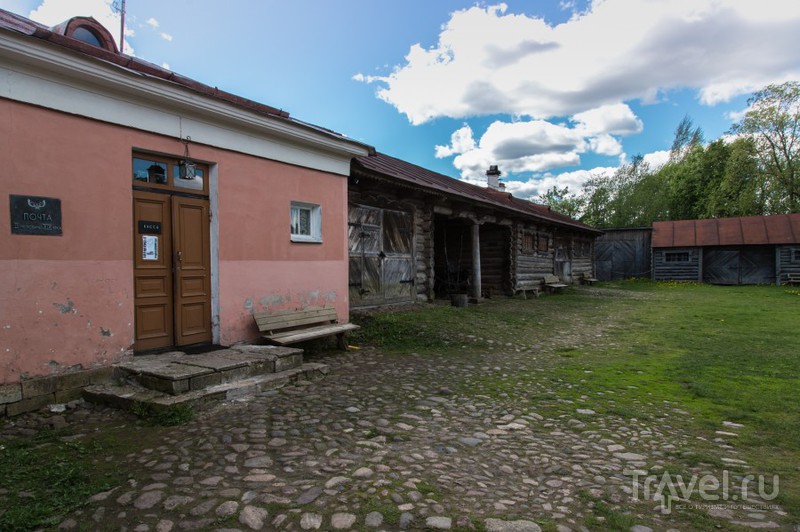
This screenshot has width=800, height=532. Identify the location of chimney. (494, 176).